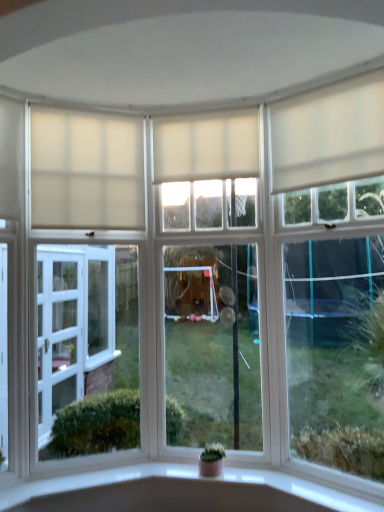
The image size is (384, 512). Describe the element at coordinates (206, 147) in the screenshot. I see `white matte curtain at center, which ranks as the 2th curtain in left-to-right order` at that location.

In order to face white matte curtain at upper right, the 3th curtain when ordered from left to right, should I rotate leftwards or rightwards?

Turn right by 16.554 degrees to look at white matte curtain at upper right, the 3th curtain when ordered from left to right.

What is the approximate width of white matte window at right, the 2th window when ordered from left to right?

The width of white matte window at right, the 2th window when ordered from left to right, is 2.78 inches.

Image resolution: width=384 pixels, height=512 pixels. Identify the location of clear glass window at center, placed as the 2th window when sorted from right to left. (212, 346).

The image size is (384, 512). What do you see at coordinates (86, 170) in the screenshot?
I see `white matte curtain at upper center, the 3th curtain in the right-to-left sequence` at bounding box center [86, 170].

You are a GUI agent. You are given a task and a screenshot of the screen. Output one action in this format:
    pyautogui.click(x=<x>, y=<y>)
    Task: Click on the white matte curtain at center, which ranks as the 2th curtain in left-to-right order
    
    Given the screenshot: What is the action you would take?
    pyautogui.click(x=206, y=147)

Would you say clear glass window at center, arranged as the first window when viewed from the left, is a long distance from white matte curtain at upper center, which is the first curtain from left to right?

They are positioned close to each other.

Considering the positions of objects clear glass window at center, arranged as the first window when viewed from the left, and white matte curtain at upper center, the 3th curtain in the right-to-left sequence, in the image provided, who is more to the left, clear glass window at center, arranged as the first window when viewed from the left, or white matte curtain at upper center, the 3th curtain in the right-to-left sequence,?

Positioned to the left is white matte curtain at upper center, the 3th curtain in the right-to-left sequence.

Is point (200, 333) positioned before point (127, 221)?

No, it is not.

From a real-world perspective, between clear glass window at center, arranged as the first window when viewed from the left, and white matte curtain at upper center, the 3th curtain in the right-to-left sequence, who is vertically higher?

white matte curtain at upper center, the 3th curtain in the right-to-left sequence, from a real-world perspective.

Is white matte curtain at upper center, the 3th curtain in the right-to-left sequence, wider or thinner than green matte houseplant at center?

Clearly, white matte curtain at upper center, the 3th curtain in the right-to-left sequence, has less width compared to green matte houseplant at center.

From the image's perspective, is white matte curtain at upper center, which is the first curtain from left to right, located above green matte houseplant at center?

Correct, white matte curtain at upper center, which is the first curtain from left to right, appears higher than green matte houseplant at center in the image.

Which is more to the right, white matte curtain at upper center, the 3th curtain in the right-to-left sequence, or green matte houseplant at center?

green matte houseplant at center.

Based on the photo, can you see white matte curtain at upper center, the 3th curtain in the right-to-left sequence, touching green matte houseplant at center?

white matte curtain at upper center, the 3th curtain in the right-to-left sequence, and green matte houseplant at center are clearly separated.

Who is smaller, white matte curtain at center, which ranks as the 2th curtain in left-to-right order, or white matte curtain at upper center, which is the first curtain from left to right?

Smaller between the two is white matte curtain at upper center, which is the first curtain from left to right.

Which of these two, white matte curtain at center, which ranks as the 2th curtain in left-to-right order, or white matte curtain at upper center, the 3th curtain in the right-to-left sequence, stands shorter?

white matte curtain at center, which ranks as the 2th curtain in left-to-right order, is shorter.

Do you think white matte curtain at center, placed as the 2th curtain when sorted from right to left, is within white matte curtain at upper center, which is the first curtain from left to right, or outside of it?

white matte curtain at center, placed as the 2th curtain when sorted from right to left, is spatially situated outside white matte curtain at upper center, which is the first curtain from left to right.

From the image's perspective, between white matte curtain at center, placed as the 2th curtain when sorted from right to left, and white matte curtain at upper center, which is the first curtain from left to right, who is located below?

white matte curtain at upper center, which is the first curtain from left to right.

Measure the distance from white matte curtain at upper right, the 1th curtain positioned from the right, to white matte curtain at center, which ranks as the 2th curtain in left-to-right order.

white matte curtain at upper right, the 1th curtain positioned from the right, is 18.11 inches from white matte curtain at center, which ranks as the 2th curtain in left-to-right order.

Which object is positioned more to the right, white matte curtain at upper right, the 1th curtain positioned from the right, or white matte curtain at center, placed as the 2th curtain when sorted from right to left?

From the viewer's perspective, white matte curtain at upper right, the 1th curtain positioned from the right, appears more on the right side.

Is white matte curtain at upper right, the 3th curtain when ordered from left to right, oriented away from white matte curtain at center, which ranks as the 2th curtain in left-to-right order?

No, white matte curtain at center, which ranks as the 2th curtain in left-to-right order, is not at the back of white matte curtain at upper right, the 3th curtain when ordered from left to right.

From the image's perspective, does clear glass window at center, arranged as the first window when viewed from the left, appear higher than white matte curtain at center, which ranks as the 2th curtain in left-to-right order?

No, from the image's perspective, clear glass window at center, arranged as the first window when viewed from the left, is not above white matte curtain at center, which ranks as the 2th curtain in left-to-right order.

Can you confirm if clear glass window at center, placed as the 2th window when sorted from right to left, is taller than white matte curtain at center, which ranks as the 2th curtain in left-to-right order?

Correct, clear glass window at center, placed as the 2th window when sorted from right to left, is much taller as white matte curtain at center, which ranks as the 2th curtain in left-to-right order.

Which is closer to the camera, (191, 327) or (189, 126)?

The point (189, 126) is in front.

From a real-world perspective, is clear glass window at center, arranged as the first window when viewed from the left, located beneath white matte curtain at center, placed as the 2th curtain when sorted from right to left?

Yes, from a real-world perspective, clear glass window at center, arranged as the first window when viewed from the left, is below white matte curtain at center, placed as the 2th curtain when sorted from right to left.

Do you think white matte window at right, the 2th window when ordered from left to right, is within green matte houseplant at center, or outside of it?

The correct answer is: outside.

How many degrees apart are the facing directions of white matte window at right, the 2th window when ordered from left to right, and green matte houseplant at center?

The facing directions of white matte window at right, the 2th window when ordered from left to right, and green matte houseplant at center are 31.1 degrees apart.

From the image's perspective, is white matte window at right, which is the 1th window in right-to-left order, located above green matte houseplant at center?

Indeed, from the image's perspective, white matte window at right, which is the 1th window in right-to-left order, is shown above green matte houseplant at center.

Consider the image. Is white matte window at right, which is the 1th window in right-to-left order, turned away from green matte houseplant at center?

No, white matte window at right, which is the 1th window in right-to-left order,'s orientation is not away from green matte houseplant at center.

Is white matte curtain at upper right, the 1th curtain positioned from the right, further to camera compared to clear glass window at center, arranged as the first window when viewed from the left?

No, white matte curtain at upper right, the 1th curtain positioned from the right, is in front of clear glass window at center, arranged as the first window when viewed from the left.

From a real-world perspective, which is physically below, white matte curtain at upper right, the 3th curtain when ordered from left to right, or clear glass window at center, arranged as the first window when viewed from the left?

In real-world perspective, clear glass window at center, arranged as the first window when viewed from the left, is lower.

Can you confirm if white matte curtain at upper right, the 3th curtain when ordered from left to right, is thinner than clear glass window at center, placed as the 2th window when sorted from right to left?

No.

Where is `the 1st window to the right of the white matte curtain at upper center, which is the first curtain from left to right, counting from the anchor's position`? The image size is (384, 512). the 1st window to the right of the white matte curtain at upper center, which is the first curtain from left to right, counting from the anchor's position is located at coordinates (212, 346).

Locate an element on the screen. The width and height of the screenshot is (384, 512). houseplant below the white matte curtain at upper center, which is the first curtain from left to right (from the image's perspective) is located at coordinates (211, 460).

When comparing their distances from white matte curtain at upper right, the 3th curtain when ordered from left to right, does white matte curtain at upper center, the 3th curtain in the right-to-left sequence, or clear glass window at center, arranged as the first window when viewed from the left, seem closer?

Based on the image, clear glass window at center, arranged as the first window when viewed from the left, appears to be nearer to white matte curtain at upper right, the 3th curtain when ordered from left to right.

From the image, which object appears to be nearer to white matte window at right, which is the 1th window in right-to-left order, white matte curtain at upper right, the 3th curtain when ordered from left to right, or white matte curtain at center, placed as the 2th curtain when sorted from right to left?

white matte curtain at upper right, the 3th curtain when ordered from left to right.

When comparing their distances from white matte curtain at upper center, the 3th curtain in the right-to-left sequence, does white matte curtain at upper right, the 1th curtain positioned from the right, or clear glass window at center, placed as the 2th window when sorted from right to left, seem further?

white matte curtain at upper right, the 1th curtain positioned from the right, is further to white matte curtain at upper center, the 3th curtain in the right-to-left sequence.

Looking at the image, which one is located closer to green matte houseplant at center, clear glass window at center, placed as the 2th window when sorted from right to left, or white matte window at right, the 2th window when ordered from left to right?

clear glass window at center, placed as the 2th window when sorted from right to left.

Considering their positions, is white matte curtain at upper right, the 1th curtain positioned from the right, positioned closer to clear glass window at center, arranged as the first window when viewed from the left, than green matte houseplant at center?

The object closer to clear glass window at center, arranged as the first window when viewed from the left, is green matte houseplant at center.

When comparing their distances from clear glass window at center, placed as the 2th window when sorted from right to left, does white matte curtain at center, placed as the 2th curtain when sorted from right to left, or white matte curtain at upper center, the 3th curtain in the right-to-left sequence, seem further?

white matte curtain at center, placed as the 2th curtain when sorted from right to left.

Based on the photo, which object lies further to the anchor point green matte houseplant at center, white matte curtain at upper center, which is the first curtain from left to right, or white matte window at right, the 2th window when ordered from left to right?

white matte curtain at upper center, which is the first curtain from left to right, is positioned further to the anchor green matte houseplant at center.

Based on their spatial positions, is white matte window at right, the 2th window when ordered from left to right, or clear glass window at center, arranged as the first window when viewed from the left, further from white matte curtain at upper center, which is the first curtain from left to right?

white matte window at right, the 2th window when ordered from left to right, is further to white matte curtain at upper center, which is the first curtain from left to right.

This screenshot has height=512, width=384. Find the location of `curtain between white matte curtain at upper right, the 3th curtain when ordered from left to right, and green matte houseplant at center, in the vertical direction`. curtain between white matte curtain at upper right, the 3th curtain when ordered from left to right, and green matte houseplant at center, in the vertical direction is located at coordinates (86, 170).

Locate an element on the screen. Image resolution: width=384 pixels, height=512 pixels. window between white matte curtain at upper right, the 3th curtain when ordered from left to right, and white matte window at right, the 2th window when ordered from left to right, in the up-down direction is located at coordinates (212, 346).

Locate an element on the screen. The height and width of the screenshot is (512, 384). curtain between white matte curtain at upper center, which is the first curtain from left to right, and white matte curtain at upper right, the 1th curtain positioned from the right, from left to right is located at coordinates (206, 147).

Where is `window that lies between clear glass window at center, placed as the 2th window when sorted from right to left, and green matte houseplant at center from top to bottom`? The height and width of the screenshot is (512, 384). window that lies between clear glass window at center, placed as the 2th window when sorted from right to left, and green matte houseplant at center from top to bottom is located at coordinates (336, 353).